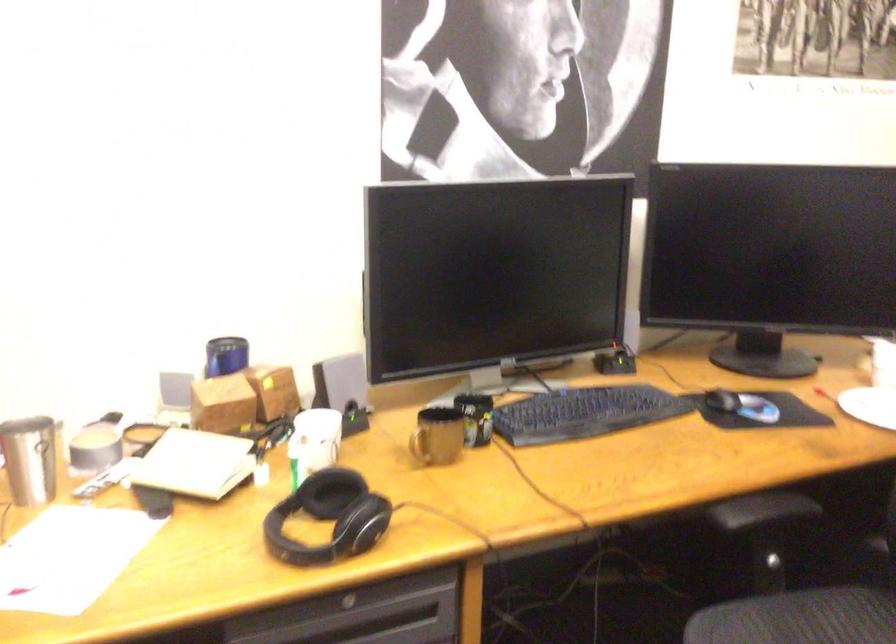
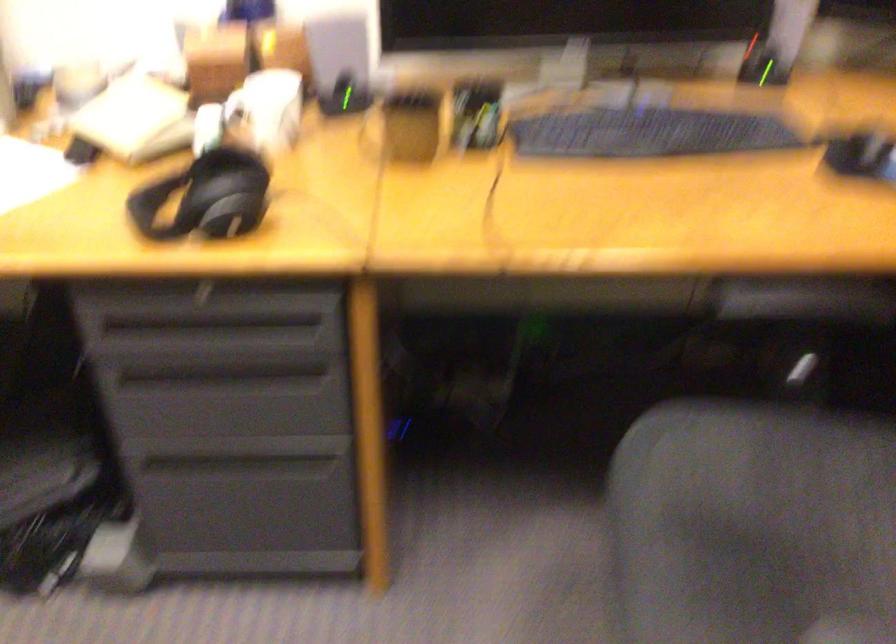
Based on the continuous images, in which direction is the camera rotating?

The camera rotated toward left-down.